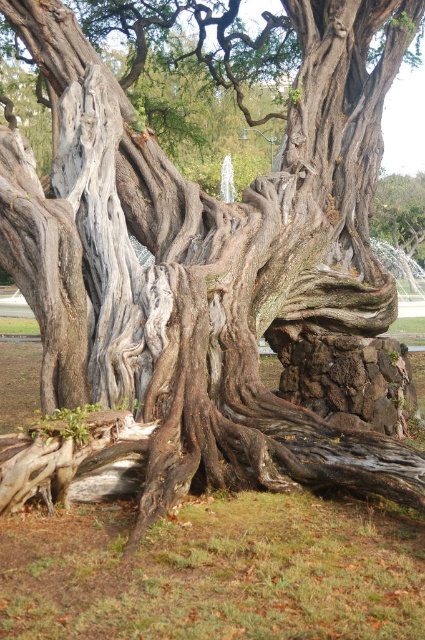
Is gray rough bark tree root at center thinner than gray rough bark tree at center?

Correct, gray rough bark tree root at center's width is less than gray rough bark tree at center's.

Between gray rough bark tree root at center and gray rough bark tree at center, which one has less height?

gray rough bark tree root at center

The width and height of the screenshot is (425, 640). Find the location of `gray rough bark tree root at center`. gray rough bark tree root at center is located at coordinates (73, 460).

Locate an element on the screen. Image resolution: width=425 pixels, height=640 pixels. gray rough bark tree root at center is located at coordinates (73, 460).